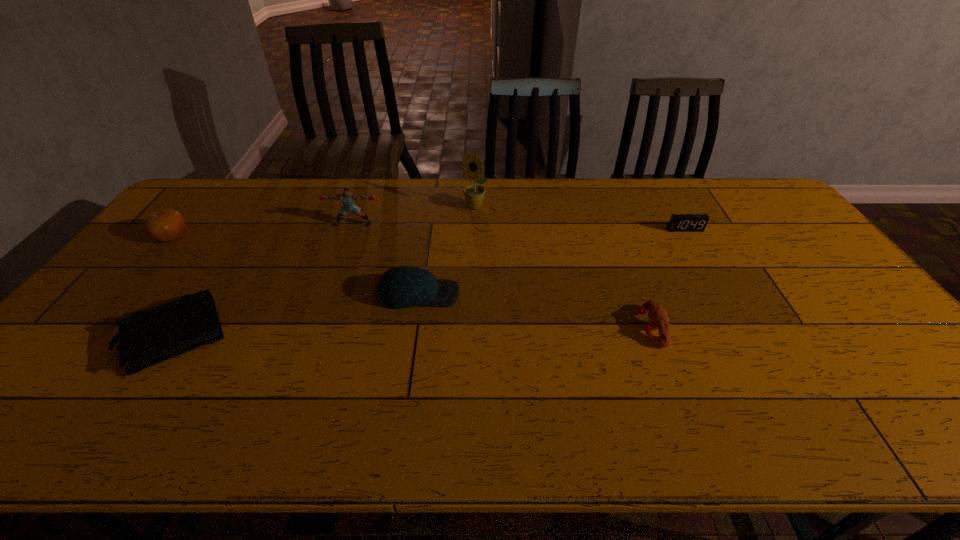
At what (x,y) coordinates should I click in order to perform the action: click on vacant space that satisfies the following two spatial constraints: 1. on the front-facing side of the alarm clock; 2. with the gloves of the shorter puncher facing forward. Please return your answer as a coordinate pair (x, y). This screenshot has height=540, width=960. Looking at the image, I should click on (740, 328).